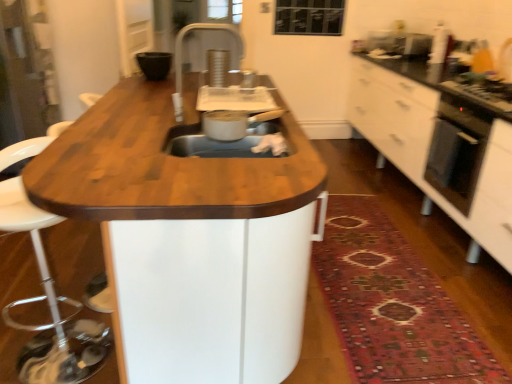
Identify the location of free point to the right of wooden table at center. Image resolution: width=512 pixels, height=384 pixels. (381, 283).